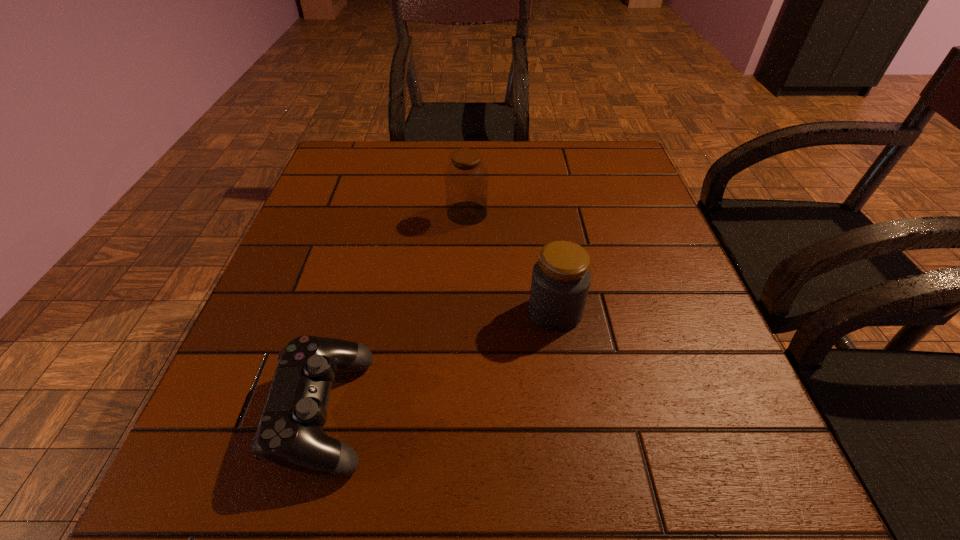
Identify the location of vacant space located 0.350m on the back of the shortest object. The image size is (960, 540). (375, 224).

Find the location of a particular element. This screenshot has width=960, height=540. object positioned at the near edge is located at coordinates (290, 434).

Locate an element on the screen. Image resolution: width=960 pixels, height=540 pixels. object present at the left edge is located at coordinates (290, 434).

You are a GUI agent. You are given a task and a screenshot of the screen. Output one action in this format:
    pyautogui.click(x=<x>, y=<y>)
    Task: Click on the object at the near left corner
    
    Given the screenshot: What is the action you would take?
    pyautogui.click(x=290, y=434)

Find the location of a particular element. The image size is (960, 540). free space at the far edge is located at coordinates (543, 149).

I want to click on vacant space at the near edge of the desktop, so click(595, 467).

Identify the location of vacant space at the left edge. This screenshot has height=540, width=960. (346, 220).

The width and height of the screenshot is (960, 540). Find the location of `vacant space at the right edge of the desktop`. vacant space at the right edge of the desktop is located at coordinates (631, 194).

I want to click on vacant area at the far left corner, so click(x=377, y=180).

In the image, there is a desktop. Identify the location of vacant space at the near left corner. (284, 476).